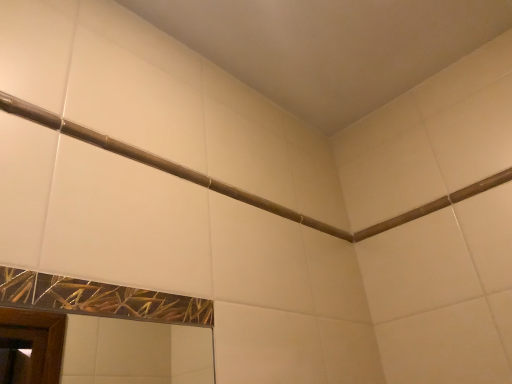
The height and width of the screenshot is (384, 512). What do you see at coordinates (157, 162) in the screenshot?
I see `matte brown shower rod at upper center` at bounding box center [157, 162].

The height and width of the screenshot is (384, 512). Identify the location of matte brown shower rod at upper center. (157, 162).

In order to face matte brown shower rod at upper center, should I rotate leftwards or rightwards?

Turn left approximately 3.358 degrees to face it.

Where is `matte brown shower rod at upper center`? The height and width of the screenshot is (384, 512). matte brown shower rod at upper center is located at coordinates (157, 162).